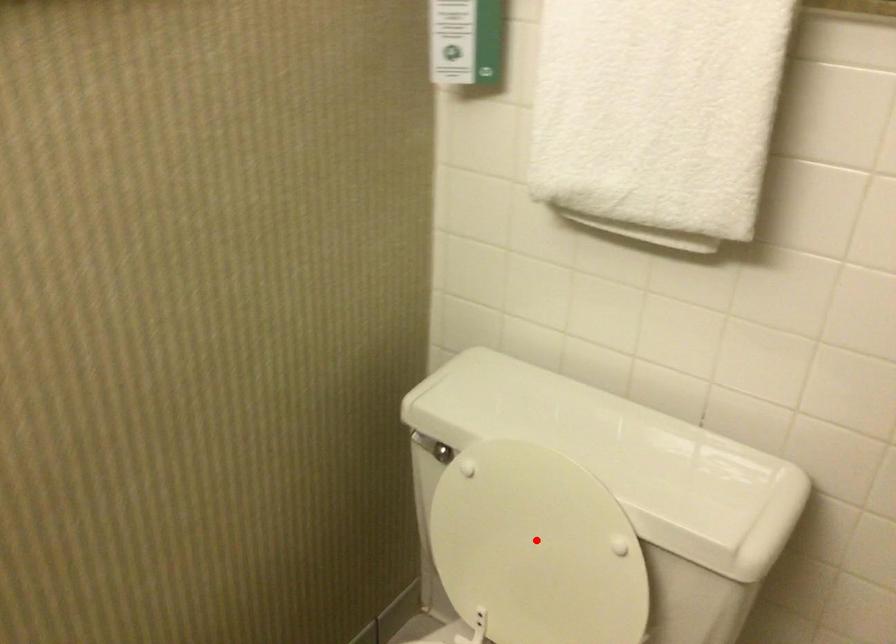
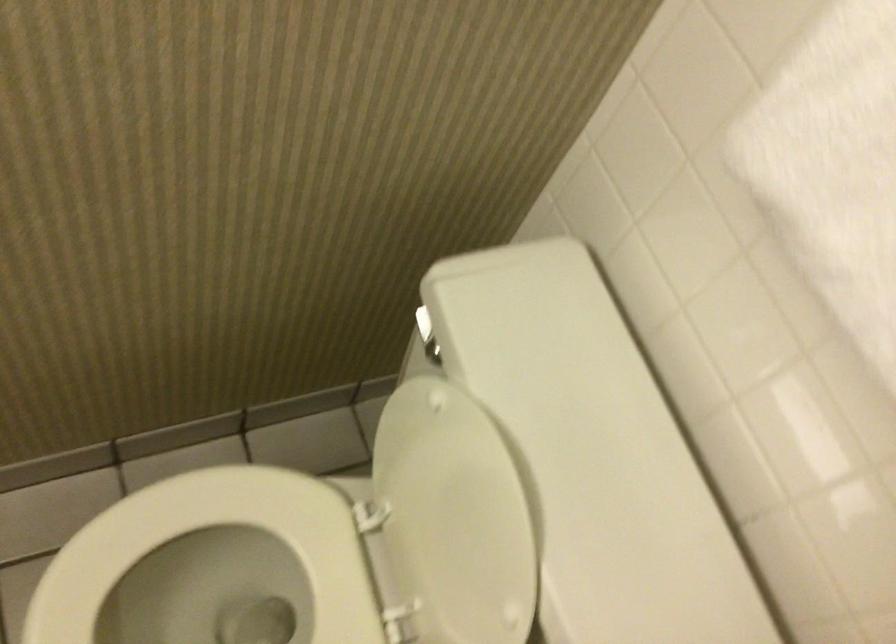
In the second image, find the point that corresponds to the highlighted location in the first image.

(453, 518)